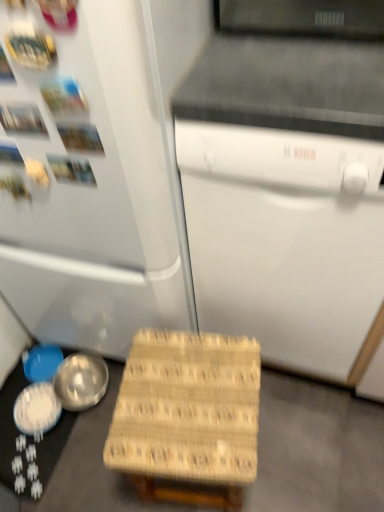
The width and height of the screenshot is (384, 512). I want to click on free space above white matte dishwasher at center (from a real-world perspective), so click(306, 59).